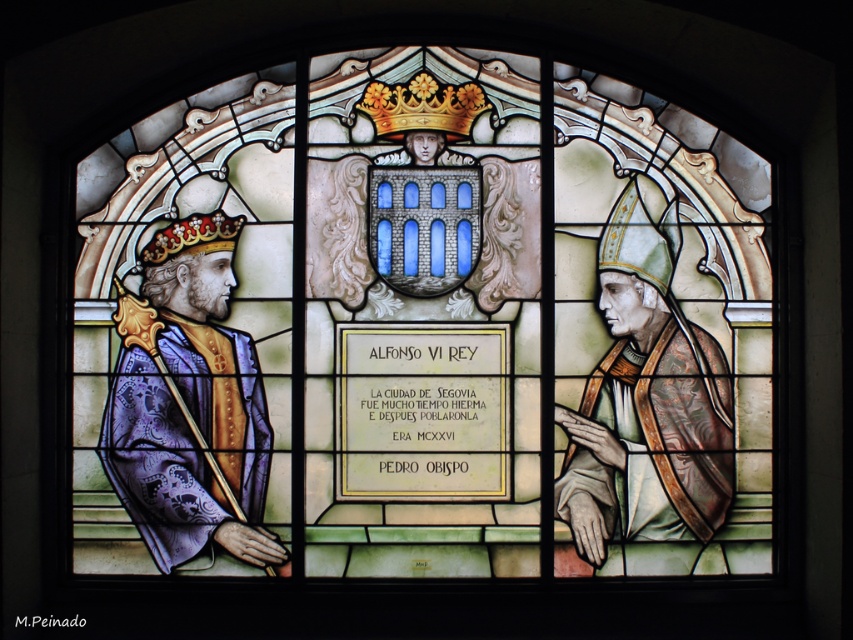
You are an art conservator examining the stained glass window. You notice the green velvet robe at right and the gold textured crown at center. Which object is closer to the viewer in the window?

The green velvet robe at right is in front of the gold textured crown at center, so it is closer to the viewer.

You are standing in front of the stained glass window and want to touch the point at coordinate point (276, 560). Can you reach it?

The point at coordinate point (276, 560) is 24.15 meters away from you, so you cannot reach it.

You are standing in front of the stained glass window and notice two points marked on it. The first point is at coordinates point (717, 496) and the second is at point (465, 104). Which point is closer to you?

Point (717, 496) is in front of point (465, 104), so it is closer to you.